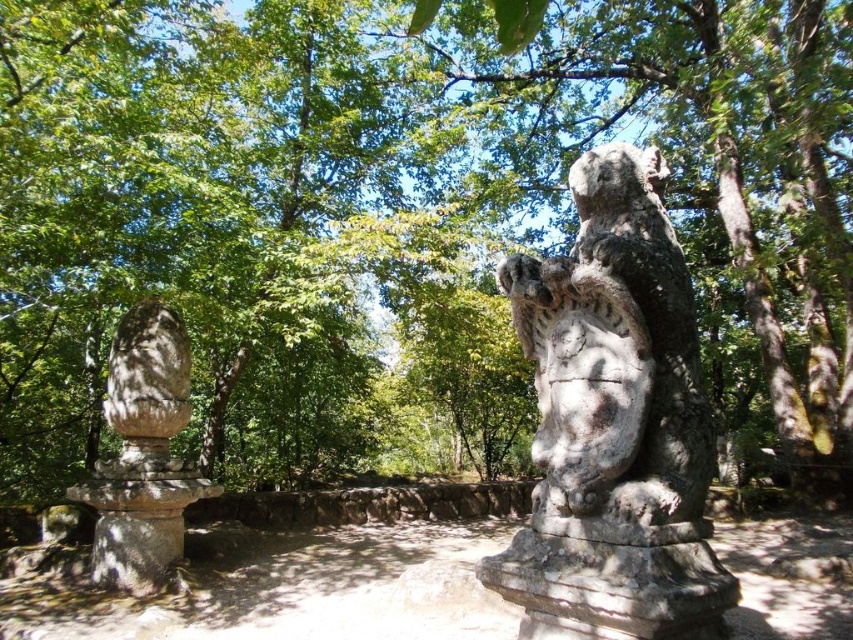
Based on the photo, you are a visitor in the park and want to take a photo of both the weathered stone owl at upper right and the rough stone statue at left. Which statue should you stand closer to in order to capture both in a single frame?

You should stand closer to the weathered stone owl at upper right because it is shorter than the rough stone statue at left, allowing both to fit within the camera frame more easily.

You are standing in the garden and want to take a photo of both the weathered stone owl at upper right and the rough stone statue at left. Which statue should you focus on first to ensure both are in frame?

You should focus on the rough stone statue at left first because the weathered stone owl at upper right is closer to the viewer, so adjusting the camera to include both would require ensuring the background statue is also within the frame.